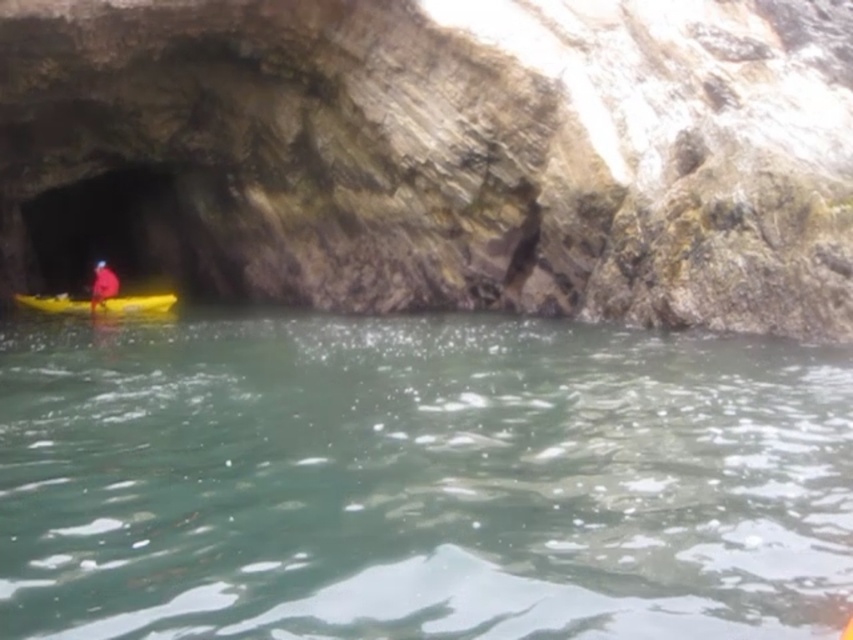
From the picture: You are planning to take a photo of the scene where the green smooth water at center and the red fabric person at left are both visible. Based on their positions, which object is wider in the image?

The green smooth water at center is wider than the red fabric person at left according to the description.

You are a drone operator tasked with capturing aerial footage of the scene. The drone has a maximum flight range of 16 meters. If you are positioned at the green smooth water at center, can you safely fly the drone to the red fabric person at left without exceeding the range limit?

The distance between the green smooth water at center and the red fabric person at left is 15.70 meters, which is within the drone operator can safely fly the drone to the red fabric person at left without exceeding the 16 meters range limit.